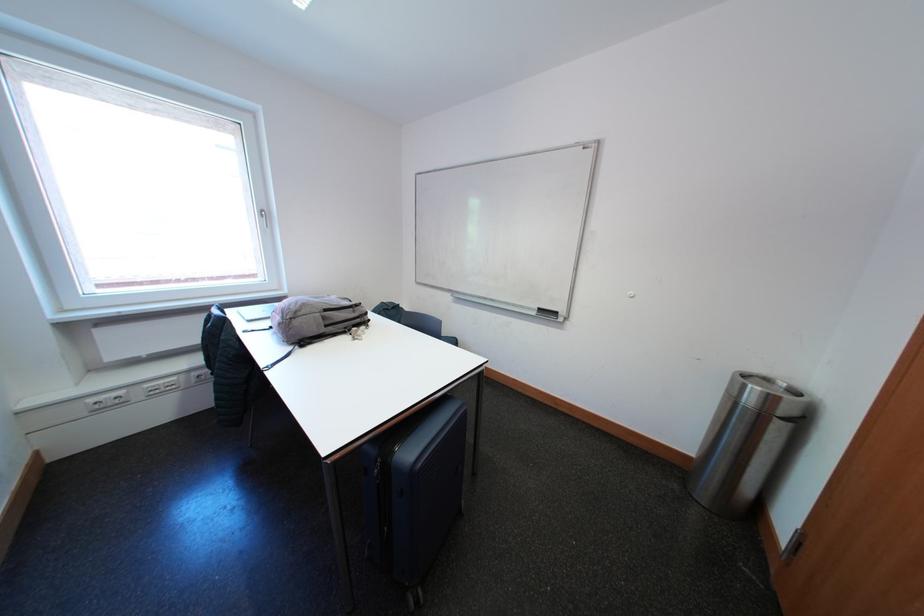
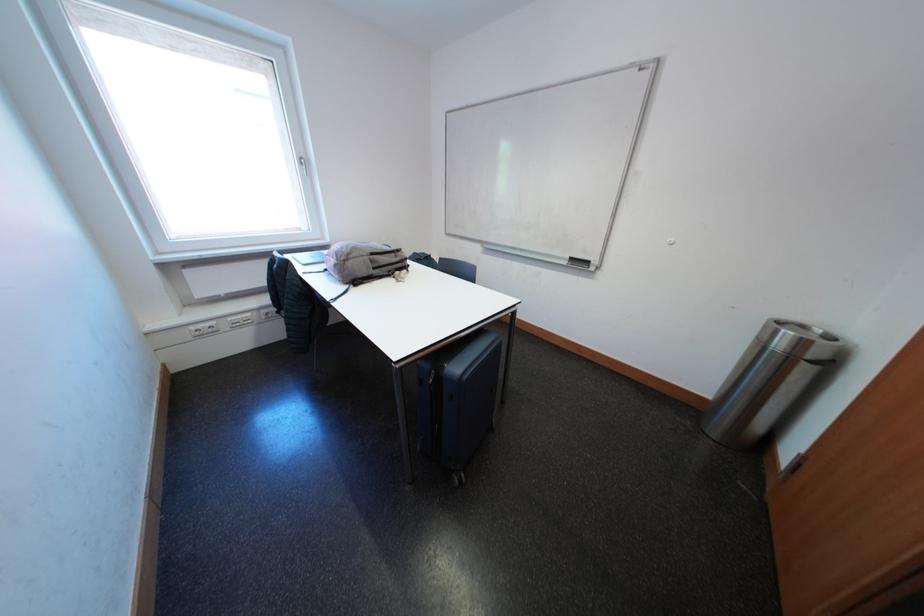
Where in the second image is the point corresponding to point 191,379 from the first image?

(264, 315)